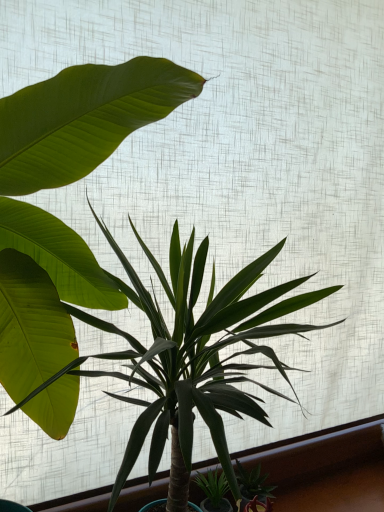
From the picture: How much space does green glossy succulent at lower right, arranged as the second houseplant when viewed from the left, occupy horizontally?

5.35 inches.

In order to face green glossy succulent at lower right, arranged as the second houseplant when viewed from the left, should I rotate leftwards or rightwards?

It's best to rotate right around 8.713 degrees.

This screenshot has height=512, width=384. What do you see at coordinates (253, 485) in the screenshot? I see `green glossy succulent at lower right, which ranks as the 1th houseplant in right-to-left order` at bounding box center [253, 485].

This screenshot has height=512, width=384. In order to click on green glossy succulent at lower right, arranged as the second houseplant when viewed from the left in this screenshot , I will do `click(253, 485)`.

What is the approximate width of green glossy plant at center, which ranks as the second houseplant in bottom-to-top order?

green glossy plant at center, which ranks as the second houseplant in bottom-to-top order, is 19.07 inches in width.

You are a GUI agent. You are given a task and a screenshot of the screen. Output one action in this format:
    pyautogui.click(x=<x>, y=<y>)
    Task: Click on the green glossy plant at center, which ranks as the second houseplant in bottom-to-top order
    This screenshot has height=512, width=384.
    Given the screenshot: What is the action you would take?
    click(190, 355)

What do you see at coordinates (190, 355) in the screenshot? I see `green glossy plant at center, which ranks as the second houseplant in bottom-to-top order` at bounding box center [190, 355].

You are a GUI agent. You are given a task and a screenshot of the screen. Output one action in this format:
    pyautogui.click(x=<x>, y=<y>)
    Task: Click on the green glossy succulent at lower right, arranged as the second houseplant when viewed from the left
    The height and width of the screenshot is (512, 384).
    Given the screenshot: What is the action you would take?
    pyautogui.click(x=253, y=485)

Is green glossy succulent at lower right, arranged as the first houseplant when ordered from the bottom, to the left or to the right of green glossy plant at center, the 1th houseplant in the top-to-bottom sequence, in the image?

In the image, green glossy succulent at lower right, arranged as the first houseplant when ordered from the bottom, appears on the right side of green glossy plant at center, the 1th houseplant in the top-to-bottom sequence.

Based on the photo, which object is closer to the camera taking this photo, green glossy succulent at lower right, which ranks as the 1th houseplant in right-to-left order, or green glossy plant at center, which ranks as the second houseplant in bottom-to-top order?

green glossy plant at center, which ranks as the second houseplant in bottom-to-top order, is in front.

Is point (242, 474) closer or farther from the camera than point (168, 292)?

Point (242, 474).

From the image's perspective, which one is positioned higher, green glossy succulent at lower right, positioned as the second houseplant in top-to-bottom order, or green glossy plant at center, which ranks as the second houseplant in bottom-to-top order?

green glossy plant at center, which ranks as the second houseplant in bottom-to-top order, from the image's perspective.

From a real-world perspective, is green glossy succulent at lower right, arranged as the second houseplant when viewed from the left, above or below green glossy plant at center, which is the 2th houseplant in right-to-left order?

Clearly, from a real-world perspective, green glossy succulent at lower right, arranged as the second houseplant when viewed from the left, is below green glossy plant at center, which is the 2th houseplant in right-to-left order.

Considering the sizes of objects green glossy succulent at lower right, positioned as the second houseplant in top-to-bottom order, and green glossy plant at center, which is the 2th houseplant in right-to-left order, in the image provided, who is wider, green glossy succulent at lower right, positioned as the second houseplant in top-to-bottom order, or green glossy plant at center, which is the 2th houseplant in right-to-left order,?

With larger width is green glossy plant at center, which is the 2th houseplant in right-to-left order.

Which of these two, green glossy succulent at lower right, which ranks as the 1th houseplant in right-to-left order, or green glossy plant at center, which ranks as the second houseplant in bottom-to-top order, stands taller?

green glossy plant at center, which ranks as the second houseplant in bottom-to-top order, is taller.

Looking at the image, does green glossy succulent at lower right, arranged as the first houseplant when ordered from the bottom, seem bigger or smaller compared to green glossy plant at center, the 1th houseplant in the top-to-bottom sequence?

Considering their sizes, green glossy succulent at lower right, arranged as the first houseplant when ordered from the bottom, takes up less space than green glossy plant at center, the 1th houseplant in the top-to-bottom sequence.

Can green glossy plant at center, arranged as the first houseplant when viewed from the left, be found inside green glossy succulent at lower right, which ranks as the 1th houseplant in right-to-left order?

No, green glossy plant at center, arranged as the first houseplant when viewed from the left, is not a part of green glossy succulent at lower right, which ranks as the 1th houseplant in right-to-left order.

Is green glossy succulent at lower right, arranged as the second houseplant when viewed from the left, in contact with green glossy plant at center, which ranks as the second houseplant in bottom-to-top order?

green glossy succulent at lower right, arranged as the second houseplant when viewed from the left, is not next to green glossy plant at center, which ranks as the second houseplant in bottom-to-top order, and they're not touching.

Is green glossy succulent at lower right, arranged as the second houseplant when viewed from the left, facing away from green glossy plant at center, arranged as the first houseplant when viewed from the left?

Yes, green glossy succulent at lower right, arranged as the second houseplant when viewed from the left, is facing away from green glossy plant at center, arranged as the first houseplant when viewed from the left.

In the scene shown: Can you tell me how much green glossy succulent at lower right, positioned as the second houseplant in top-to-bottom order, and green glossy plant at center, arranged as the first houseplant when viewed from the left, differ in facing direction?

27.7 degrees separate the facing orientations of green glossy succulent at lower right, positioned as the second houseplant in top-to-bottom order, and green glossy plant at center, arranged as the first houseplant when viewed from the left.

How much distance is there between green glossy succulent at lower right, positioned as the second houseplant in top-to-bottom order, and green glossy plant at center, the 1th houseplant in the top-to-bottom sequence?

They are 15.84 inches apart.

You are a GUI agent. You are given a task and a screenshot of the screen. Output one action in this format:
    pyautogui.click(x=<x>, y=<y>)
    Task: Click on the houseplant below the green glossy plant at center, which is the 2th houseplant in right-to-left order (from the image's perspective)
    This screenshot has height=512, width=384.
    Given the screenshot: What is the action you would take?
    pyautogui.click(x=253, y=485)

Between green glossy plant at center, which is the 2th houseplant in right-to-left order, and green glossy succulent at lower right, which ranks as the 1th houseplant in right-to-left order, which one appears on the left side from the viewer's perspective?

From the viewer's perspective, green glossy plant at center, which is the 2th houseplant in right-to-left order, appears more on the left side.

Which object is closer to the camera, green glossy plant at center, which ranks as the second houseplant in bottom-to-top order, or green glossy succulent at lower right, positioned as the second houseplant in top-to-bottom order?

green glossy plant at center, which ranks as the second houseplant in bottom-to-top order, is in front.

Considering the positions of points (148, 426) and (251, 485), is point (148, 426) farther from camera compared to point (251, 485)?

That is False.

From the image's perspective, which object appears higher, green glossy plant at center, arranged as the first houseplant when viewed from the left, or green glossy succulent at lower right, arranged as the second houseplant when viewed from the left?

green glossy plant at center, arranged as the first houseplant when viewed from the left, is shown above in the image.

Consider the image. From a real-world perspective, is green glossy plant at center, the 1th houseplant in the top-to-bottom sequence, physically located above or below green glossy succulent at lower right, which ranks as the 1th houseplant in right-to-left order?

From a real-world perspective, green glossy plant at center, the 1th houseplant in the top-to-bottom sequence, is physically above green glossy succulent at lower right, which ranks as the 1th houseplant in right-to-left order.

Looking at their sizes, would you say green glossy plant at center, which ranks as the second houseplant in bottom-to-top order, is wider or thinner than green glossy succulent at lower right, arranged as the second houseplant when viewed from the left?

In the image, green glossy plant at center, which ranks as the second houseplant in bottom-to-top order, appears to be wider than green glossy succulent at lower right, arranged as the second houseplant when viewed from the left.

From the picture: Considering the relative sizes of green glossy plant at center, the 1th houseplant in the top-to-bottom sequence, and green glossy succulent at lower right, arranged as the first houseplant when ordered from the bottom, in the image provided, is green glossy plant at center, the 1th houseplant in the top-to-bottom sequence, shorter than green glossy succulent at lower right, arranged as the first houseplant when ordered from the bottom,?

In fact, green glossy plant at center, the 1th houseplant in the top-to-bottom sequence, may be taller than green glossy succulent at lower right, arranged as the first houseplant when ordered from the bottom.

Based on their sizes in the image, would you say green glossy plant at center, arranged as the first houseplant when viewed from the left, is bigger or smaller than green glossy succulent at lower right, which ranks as the 1th houseplant in right-to-left order?

In the image, green glossy plant at center, arranged as the first houseplant when viewed from the left, appears to be larger than green glossy succulent at lower right, which ranks as the 1th houseplant in right-to-left order.

Which is correct: green glossy plant at center, which is the 2th houseplant in right-to-left order, is inside green glossy succulent at lower right, arranged as the first houseplant when ordered from the bottom, or outside of it?

green glossy plant at center, which is the 2th houseplant in right-to-left order, lies outside green glossy succulent at lower right, arranged as the first houseplant when ordered from the bottom.

Is green glossy plant at center, which is the 2th houseplant in right-to-left order, not near green glossy succulent at lower right, which ranks as the 1th houseplant in right-to-left order?

Answer: green glossy plant at center, which is the 2th houseplant in right-to-left order, is actually quite close to green glossy succulent at lower right, which ranks as the 1th houseplant in right-to-left order.

Looking at this image, is green glossy plant at center, arranged as the first houseplant when viewed from the left, oriented away from green glossy succulent at lower right, arranged as the first houseplant when ordered from the bottom?

No, green glossy plant at center, arranged as the first houseplant when viewed from the left, is not facing away from green glossy succulent at lower right, arranged as the first houseplant when ordered from the bottom.

How many degrees apart are the facing directions of green glossy plant at center, which is the 2th houseplant in right-to-left order, and green glossy succulent at lower right, arranged as the first houseplant when ordered from the bottom?

The angular difference between green glossy plant at center, which is the 2th houseplant in right-to-left order, and green glossy succulent at lower right, arranged as the first houseplant when ordered from the bottom, is 27.7 degrees.

Could you measure the distance between green glossy plant at center, the 1th houseplant in the top-to-bottom sequence, and green glossy succulent at lower right, positioned as the second houseplant in top-to-bottom order?

The distance of green glossy plant at center, the 1th houseplant in the top-to-bottom sequence, from green glossy succulent at lower right, positioned as the second houseplant in top-to-bottom order, is 15.84 inches.

The height and width of the screenshot is (512, 384). In order to click on houseplant in front of the green glossy succulent at lower right, which ranks as the 1th houseplant in right-to-left order in this screenshot , I will do `click(190, 355)`.

Find the location of `houseplant above the green glossy succulent at lower right, positioned as the second houseplant in top-to-bottom order (from a real-world perspective)`. houseplant above the green glossy succulent at lower right, positioned as the second houseplant in top-to-bottom order (from a real-world perspective) is located at coordinates click(x=190, y=355).

Locate an element on the screen. houseplant below the green glossy plant at center, the 1th houseplant in the top-to-bottom sequence (from a real-world perspective) is located at coordinates (253, 485).